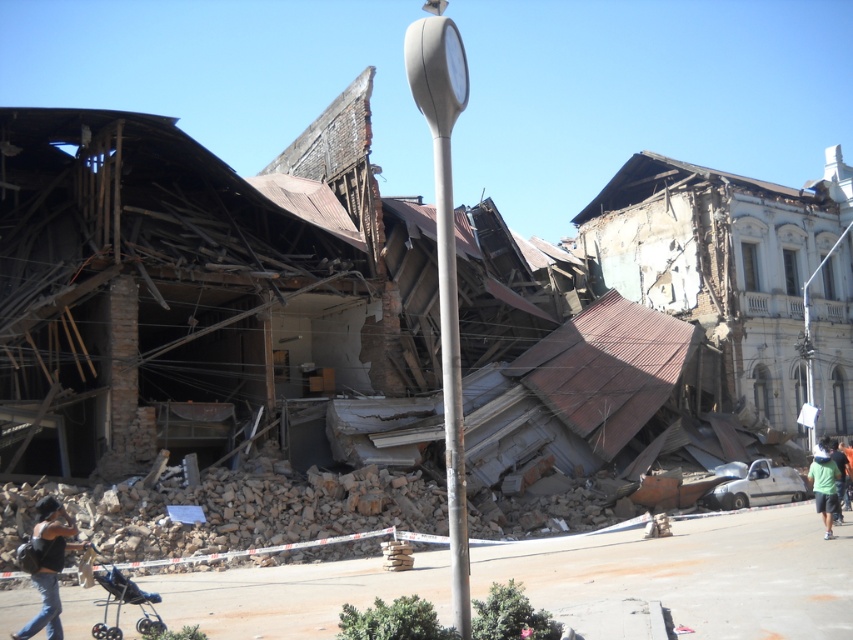
Question: Which object is the closest to the metallic gray pole at center?

Choices:
 (A) dark gray fabric backpack at lower left
 (B) black plastic baby carriage at lower left
 (C) green fabric shirt at lower right

Answer: (A)

Question: Can you confirm if metallic gray pole at center is thinner than dark gray fabric backpack at lower left?

Choices:
 (A) yes
 (B) no

Answer: (A)

Question: Which object appears closest to the camera in this image?

Choices:
 (A) metallic gray pole at center
 (B) black plastic baby carriage at lower left
 (C) green fabric shirt at lower right
 (D) dark gray fabric backpack at lower left

Answer: (A)

Question: Does dark gray fabric backpack at lower left lie in front of green fabric shirt at lower right?

Choices:
 (A) yes
 (B) no

Answer: (A)

Question: Which of these objects is positioned farthest from the green fabric shirt at lower right?

Choices:
 (A) black plastic baby carriage at lower left
 (B) dark gray fabric backpack at lower left
 (C) metallic gray pole at center

Answer: (A)

Question: Is black plastic baby carriage at lower left in front of green fabric shirt at lower right?

Choices:
 (A) no
 (B) yes

Answer: (B)